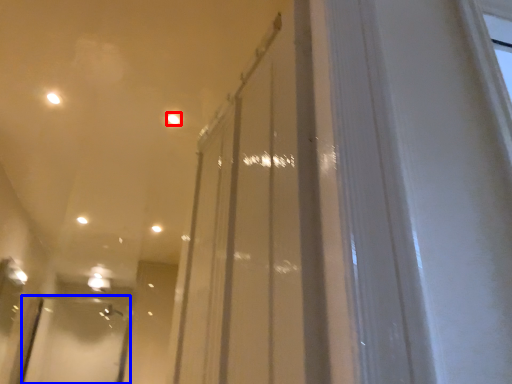
Question: Which of the following is the closest to the observer, light (highlighted by a red box) or screen door (highlighted by a blue box)?

Choices:
 (A) light
 (B) screen door

Answer: (A)